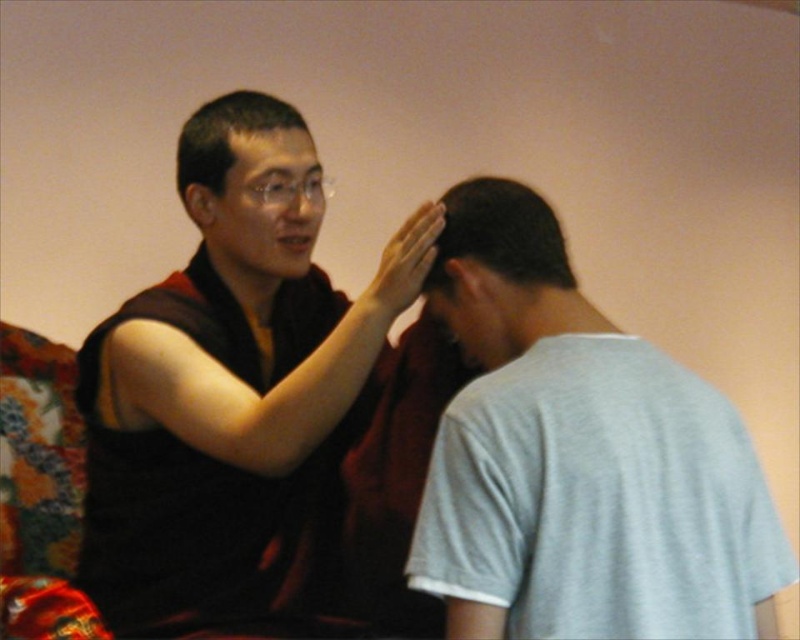
You are standing at point (x=264, y=156) and want to move to point (x=220, y=604). Is the point you want to reach in front of or behind your current position?

The point you want to reach, point (x=220, y=604), is behind your current position at point (x=264, y=156).

You are standing in the scene and want to place a small flower between the two points, point (529, 220) and point (254, 141). Which point should the flower be closer to if you want it to appear larger in the image?

The flower should be placed closer to point (529, 220) because it is closer to the viewer than point (254, 141), making objects placed there appear larger.